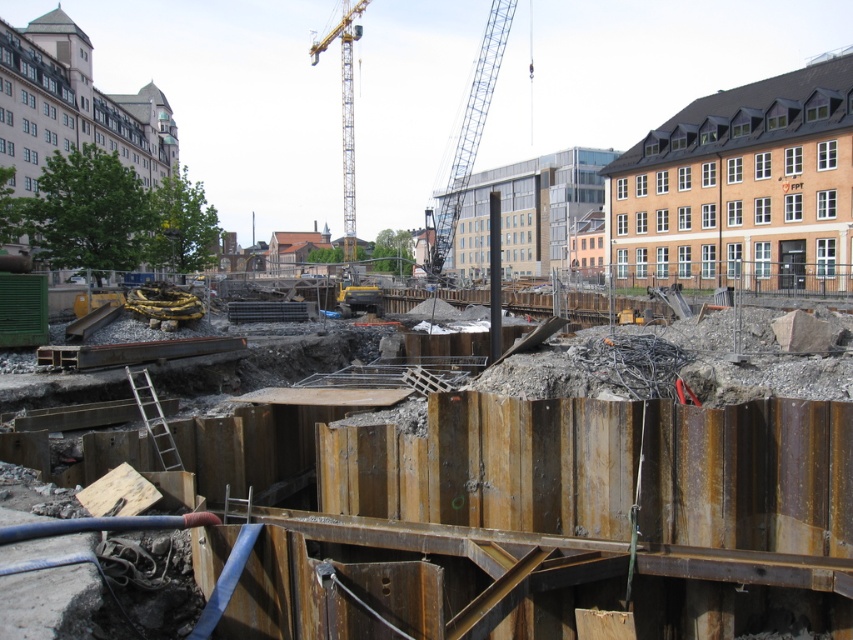
Question: Can you confirm if blue metallic crane at center is smaller than yellow metallic crane at upper center?

Choices:
 (A) no
 (B) yes

Answer: (A)

Question: Is rusty metal sheet at center smaller than yellow metallic crane at upper center?

Choices:
 (A) no
 (B) yes

Answer: (B)

Question: Which point is closer to the camera taking this photo?

Choices:
 (A) (352, 112)
 (B) (428, 625)

Answer: (B)

Question: Considering the real-world distances, which object is closest to the rusty metal sheet at center?

Choices:
 (A) blue metallic crane at center
 (B) yellow metallic crane at upper center

Answer: (A)

Question: Is rusty metal sheet at center to the left of yellow metallic crane at upper center from the viewer's perspective?

Choices:
 (A) yes
 (B) no

Answer: (B)

Question: Which point is farther to the camera?

Choices:
 (A) rusty metal sheet at center
 (B) blue metallic crane at center
 (C) yellow metallic crane at upper center

Answer: (C)